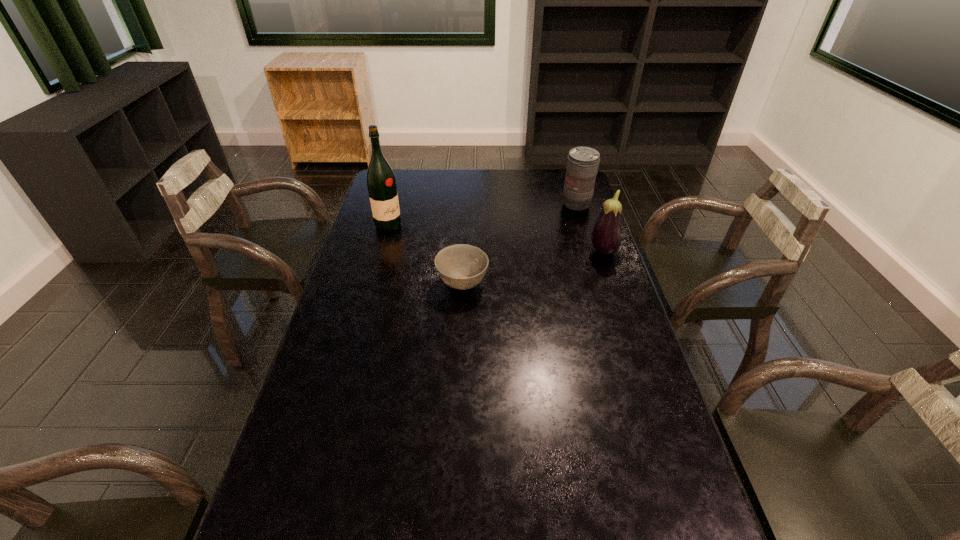
I want to click on free space at the right edge, so click(642, 406).

Image resolution: width=960 pixels, height=540 pixels. Identify the location of vacant space that is in between the third farthest object and the telephoto lens. (589, 228).

I want to click on vacant space that is in between the shortest object and the leftmost object, so click(x=425, y=254).

I want to click on free space between the second object from left to right and the second farthest object, so click(x=425, y=254).

I want to click on free space between the tallest object and the farthest object, so click(482, 215).

At what (x,y) coordinates should I click in order to perform the action: click on empty location between the nearest object and the tallest object. Please return your answer as a coordinate pair (x, y). This screenshot has width=960, height=540. Looking at the image, I should click on [425, 254].

Locate an element on the screen. The height and width of the screenshot is (540, 960). unoccupied position between the bowl and the eggplant is located at coordinates (533, 268).

This screenshot has width=960, height=540. I want to click on unoccupied position between the third object from right to left and the eggplant, so click(x=533, y=268).

Find the location of `blank region between the farthest object and the eggplant`. blank region between the farthest object and the eggplant is located at coordinates (589, 228).

This screenshot has width=960, height=540. I want to click on empty location between the nearest object and the leftmost object, so click(425, 254).